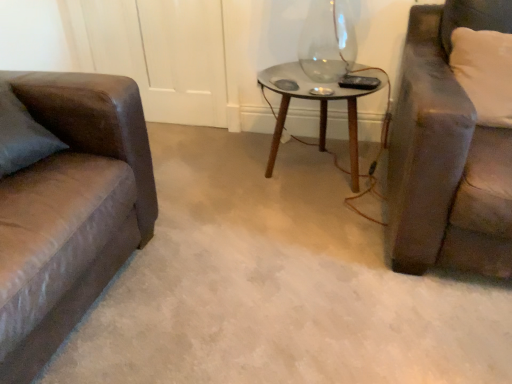
Question: In the image, is clear glass table at center on the left side or the right side of white fabric pillow at right?

Choices:
 (A) left
 (B) right

Answer: (A)

Question: From the image's perspective, is clear glass table at center above or below white fabric pillow at right?

Choices:
 (A) above
 (B) below

Answer: (B)

Question: Choose the correct answer: Is clear glass table at center inside white fabric pillow at right or outside it?

Choices:
 (A) inside
 (B) outside

Answer: (B)

Question: Considering their positions, is white fabric pillow at right located in front of or behind clear glass table at center?

Choices:
 (A) behind
 (B) front

Answer: (B)

Question: Which is correct: white fabric pillow at right is inside clear glass table at center, or outside of it?

Choices:
 (A) outside
 (B) inside

Answer: (A)

Question: From the image's perspective, is white fabric pillow at right above or below clear glass table at center?

Choices:
 (A) below
 (B) above

Answer: (B)

Question: From a real-world perspective, relative to clear glass table at center, is white fabric pillow at right vertically above or below?

Choices:
 (A) below
 (B) above

Answer: (B)